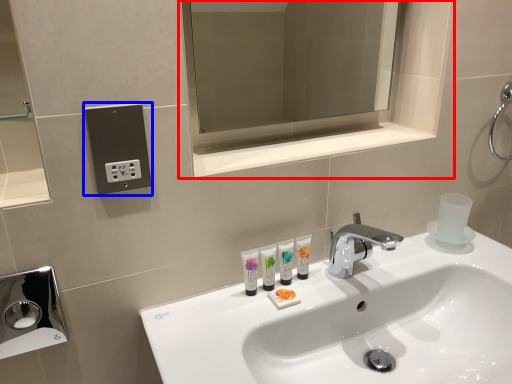
Question: Which of the following is the closest to the observer, medicine cabinet (highlighted by a red box) or electric outlet (highlighted by a blue box)?

Choices:
 (A) medicine cabinet
 (B) electric outlet

Answer: (B)